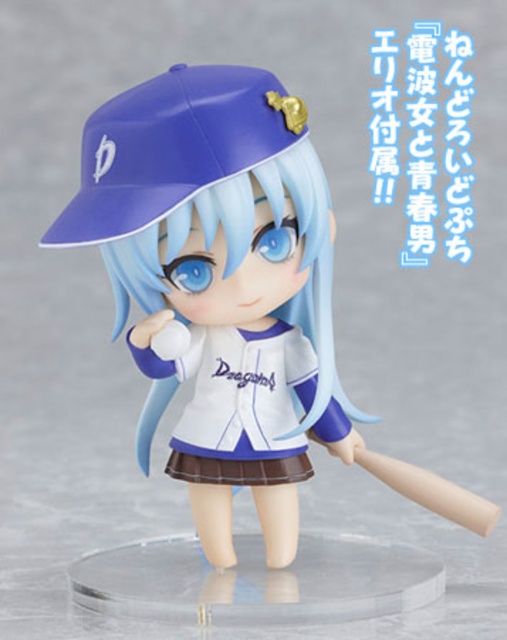
Question: Which point is farther to the camera?

Choices:
 (A) click(197, 308)
 (B) click(431, 486)
 (C) click(100, 113)
 (D) click(189, 432)

Answer: (D)

Question: Which object is farther from the camera taking this photo?

Choices:
 (A) white matte baseball uniform at center
 (B) white matte baseball cap at upper center
 (C) beige matte baseball bat at center
 (D) matte blue baseball cap at upper center

Answer: (C)

Question: Does white matte baseball uniform at center come behind beige matte baseball bat at center?

Choices:
 (A) yes
 (B) no

Answer: (B)

Question: Which point appears farthest from the camera in this image?

Choices:
 (A) 206,136
 (B) 81,188
 (C) 342,417

Answer: (C)

Question: Is matte blue baseball cap at upper center thinner than white matte baseball uniform at center?

Choices:
 (A) no
 (B) yes

Answer: (A)

Question: Is white matte baseball cap at upper center further to camera compared to beige matte baseball bat at center?

Choices:
 (A) no
 (B) yes

Answer: (A)